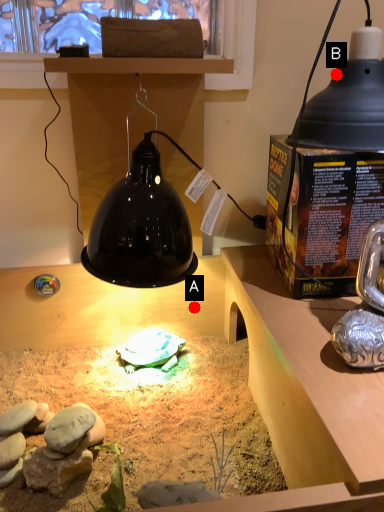
Question: Two points are circled on the image, labeled by A and B beside each circle. Which point is farther to the camera?

Choices:
 (A) A is further
 (B) B is further

Answer: (A)